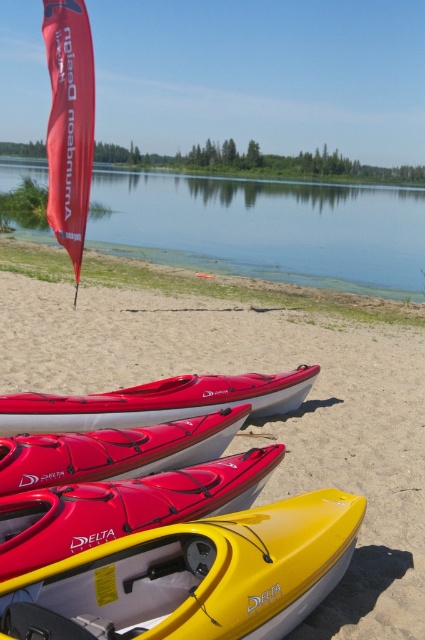
Can you confirm if yellow matte kayak at center is taller than shiny red kayak at center?

No, yellow matte kayak at center is not taller than shiny red kayak at center.

Is point (13, 547) positioned before point (130, 452)?

Yes.

At what (x,y) coordinates should I click in order to perform the action: click on yellow matte kayak at center. Please return your answer as a coordinate pair (x, y). Looking at the image, I should click on (124, 508).

Who is taller, yellow matte kayak at lower center or yellow matte kayak at center?

yellow matte kayak at lower center is taller.

Does yellow matte kayak at lower center appear under yellow matte kayak at center?

Actually, yellow matte kayak at lower center is above yellow matte kayak at center.

What do you see at coordinates (266, 417) in the screenshot?
I see `yellow matte kayak at lower center` at bounding box center [266, 417].

Where is `yellow matte kayak at lower center`? yellow matte kayak at lower center is located at coordinates (266, 417).

Between point (266, 452) and point (271, 396), which one is positioned in front?

Point (266, 452)

Does yellow matte kayak at center lie in front of matte red kayak at center?

Yes, it is in front of matte red kayak at center.

Who is more distant from viewer, (14,564) or (133,401)?

The point (133,401) is behind.

Image resolution: width=425 pixels, height=640 pixels. I want to click on yellow matte kayak at center, so click(124, 508).